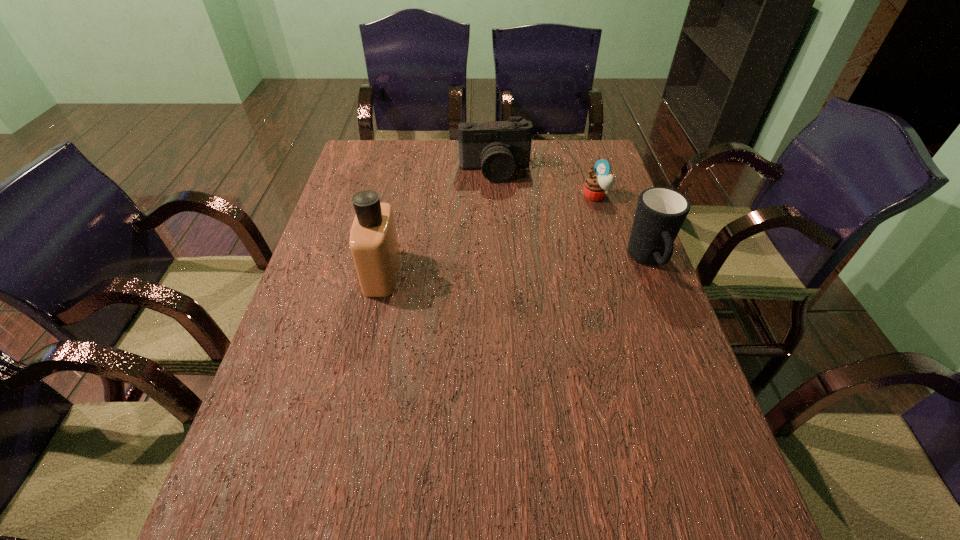
Locate an element on the screen. The height and width of the screenshot is (540, 960). empty space that is in between the third object from right to left and the shortest object is located at coordinates (545, 183).

Identify the location of blank region between the mug and the camera. Image resolution: width=960 pixels, height=540 pixels. (571, 216).

Identify the location of vacant space in between the mug and the farthest object. The width and height of the screenshot is (960, 540). (571, 216).

You are a GUI agent. You are given a task and a screenshot of the screen. Output one action in this format:
    pyautogui.click(x=<x>, y=<y>)
    Task: Click on the free space between the mug and the farthest object
    The width and height of the screenshot is (960, 540).
    Given the screenshot: What is the action you would take?
    pyautogui.click(x=571, y=216)

Identify the location of vacant space that is in between the mug and the third object from right to left. The height and width of the screenshot is (540, 960). (571, 216).

Find the location of a particular element. This screenshot has height=540, width=960. free spot between the shortest object and the mug is located at coordinates (622, 228).

Identify the location of object that is the third closest to the leftmost object. (660, 213).

Identify which object is the third nearest to the mug. Please provide its 2D coordinates. Your answer should be formatted as a tuple, i.e. [(x, y)], where the tuple contains the x and y coordinates of a point satisfying the conditions above.

[(373, 242)]